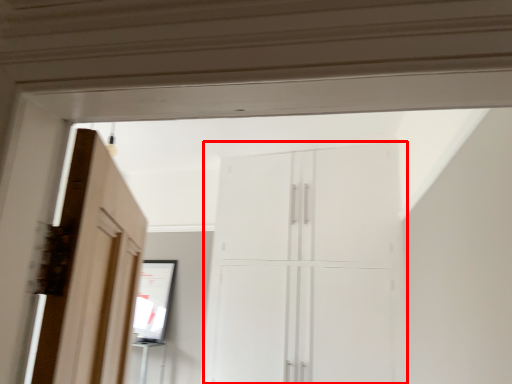
Question: From the image's perspective, what is the correct spatial positioning of cupboard (annotated by the red box) in reference to mirror?

Choices:
 (A) above
 (B) below

Answer: (A)